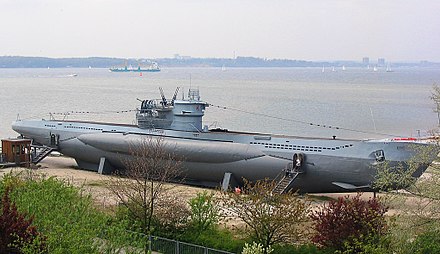
Find the location of a particular element. The width and height of the screenshot is (440, 254). bottom left corner empty space is located at coordinates pos(5,251).